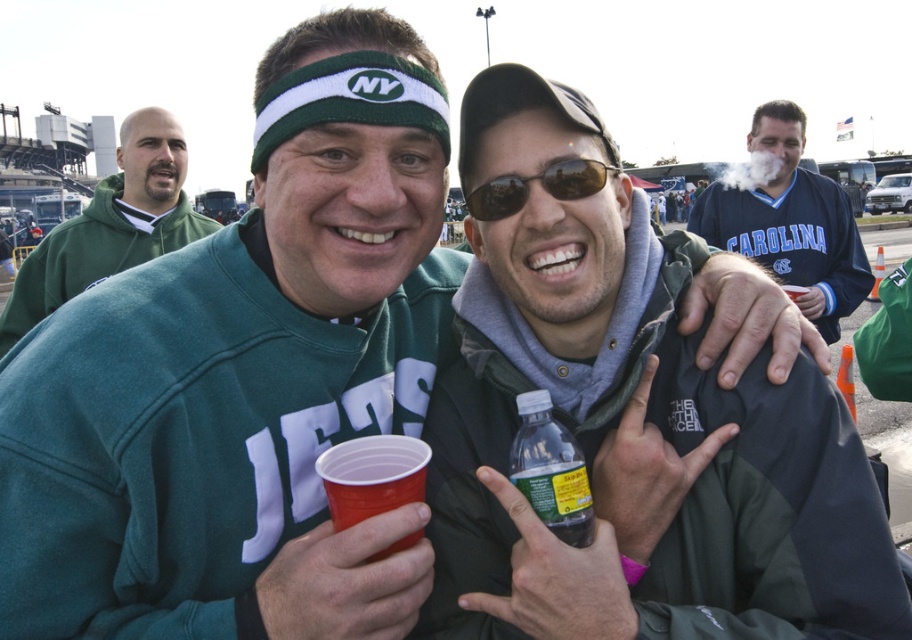
Question: Which is nearer to the translucent plastic bottle at center?

Choices:
 (A) blue jersey at upper right
 (B) sunglasses at center

Answer: (B)

Question: Which point is farther to the camera?

Choices:
 (A) translucent plastic bottle at center
 (B) green fleece sweatshirt at upper left
 (C) clear plastic bottle at center
 (D) blue jersey at upper right

Answer: (D)

Question: Is green fleece sweatshirt at upper left further to the viewer compared to clear plastic bottle at center?

Choices:
 (A) no
 (B) yes

Answer: (B)

Question: Which point is farther to the camera?

Choices:
 (A) (574, 477)
 (B) (769, 196)

Answer: (B)

Question: Is green fleece sweatshirt at upper left smaller than sunglasses at center?

Choices:
 (A) no
 (B) yes

Answer: (A)

Question: Can you confirm if blue jersey at upper right is positioned to the left of sunglasses at center?

Choices:
 (A) no
 (B) yes

Answer: (A)